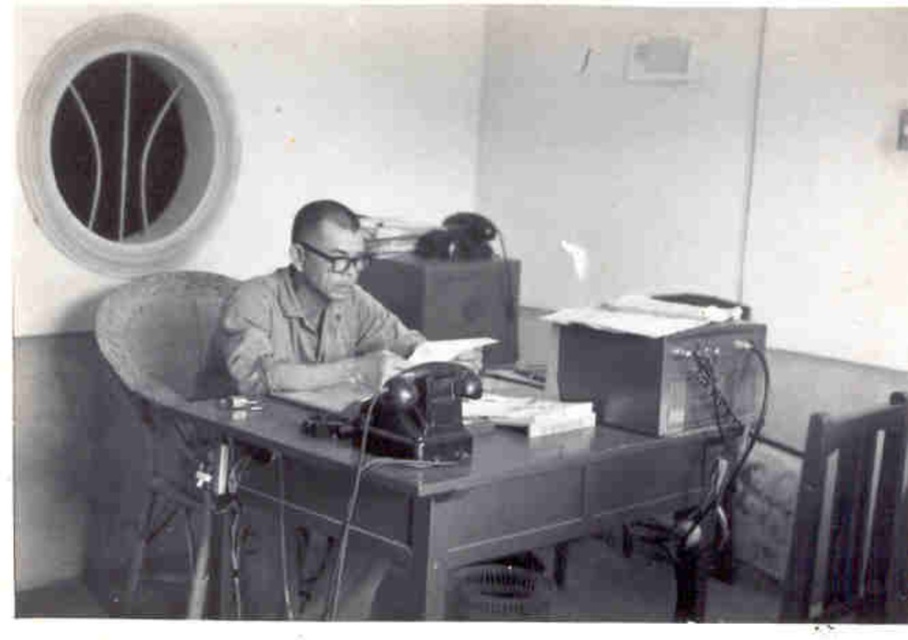
You are standing in the office shown in the image. You need to place a new document organizer on the metallic gray table at center. Where exactly should you place it?

The metallic gray table at center is located at coordinates point (457, 492), so place the document organizer there.

You are an office worker who needs to sit down to work. You see a wooden chair at right and a metallic wireframe chair at lower right. Which chair is located more to the right side of the office?

The wooden chair at right is positioned on the right side of metallic wireframe chair at lower right, so it is more to the right.